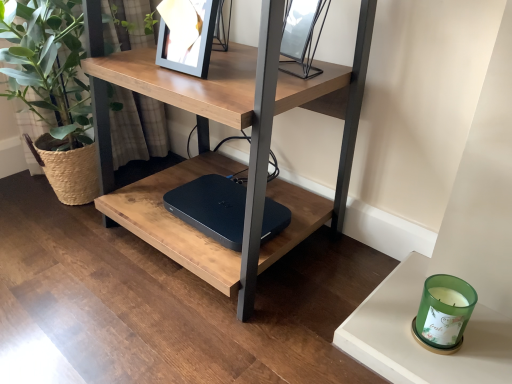
Question: Considering the positions of green glass candle at lower right and metallic silver picture frame at upper center in the image, is green glass candle at lower right wider or thinner than metallic silver picture frame at upper center?

Choices:
 (A) wide
 (B) thin

Answer: (B)

Question: From a real-world perspective, is green glass candle at lower right positioned above or below metallic silver picture frame at upper center?

Choices:
 (A) above
 (B) below

Answer: (B)

Question: Which of these objects is positioned farthest from the black matte laptop at center?

Choices:
 (A) metallic silver picture frame at upper center
 (B) green woven basket at left
 (C) matte wood table at center
 (D) green glass candle at lower right

Answer: (D)

Question: Which object is the closest to the green woven basket at left?

Choices:
 (A) matte wood table at center
 (B) metallic silver picture frame at upper center
 (C) black matte laptop at center
 (D) green glass candle at lower right

Answer: (A)